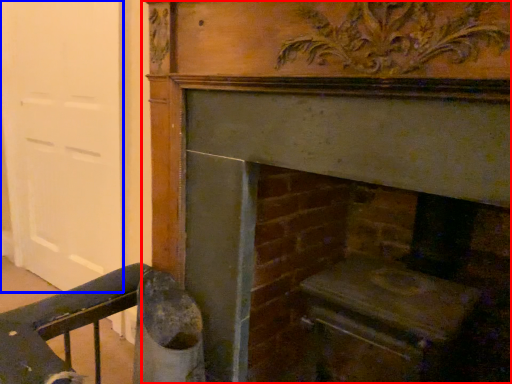
Question: Which of the following is the farthest to the observer, fireplace (highlighted by a red box) or door (highlighted by a blue box)?

Choices:
 (A) fireplace
 (B) door

Answer: (B)